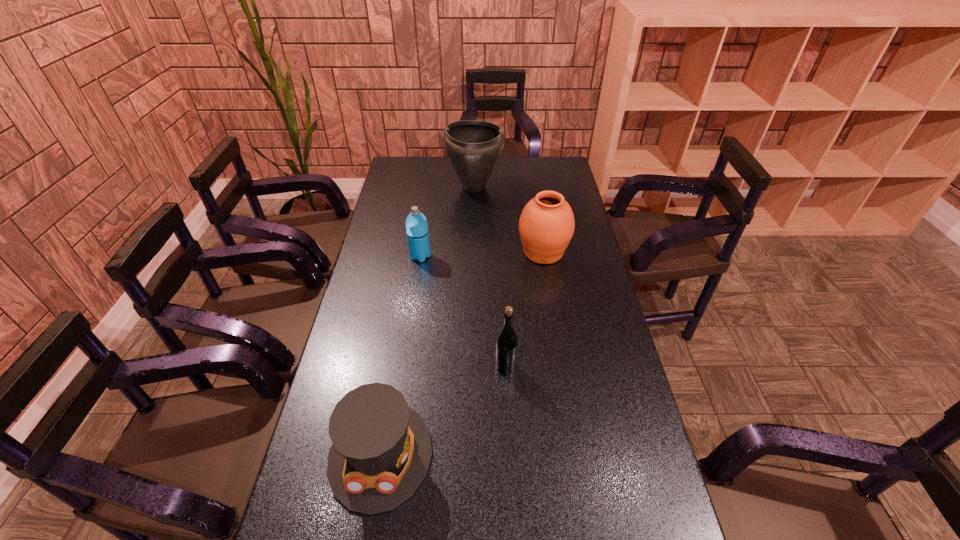
Locate an element on the screen. vacant region between the thermos bottle and the dress hat is located at coordinates (400, 355).

You are a GUI agent. You are given a task and a screenshot of the screen. Output one action in this format:
    pyautogui.click(x=<x>, y=<y>)
    Task: Click on the empty space that is in between the right urn and the dress hat
    
    Given the screenshot: What is the action you would take?
    pyautogui.click(x=462, y=353)

Find the location of a particular element. free spot between the shortest object and the beer bottle is located at coordinates (444, 411).

Locate an element on the screen. vacant area that lies between the rightmost object and the dress hat is located at coordinates (462, 353).

This screenshot has height=540, width=960. What are the coordinates of `vacant area between the nearest object and the rightmost object` in the screenshot? It's located at (462, 353).

The height and width of the screenshot is (540, 960). Find the location of `unoccupied position between the nearer urn and the thermos bottle`. unoccupied position between the nearer urn and the thermos bottle is located at coordinates (482, 254).

What are the coordinates of `vacant point located between the right urn and the left urn` in the screenshot? It's located at (509, 219).

Find the location of a particular element. The image size is (960, 540). vacant space that is in between the beer bottle and the nearer urn is located at coordinates tap(524, 310).

Locate an element on the screen. This screenshot has height=540, width=960. free area in between the left urn and the nearer urn is located at coordinates (509, 219).

This screenshot has width=960, height=540. I want to click on vacant area that lies between the beer bottle and the thermos bottle, so click(463, 312).